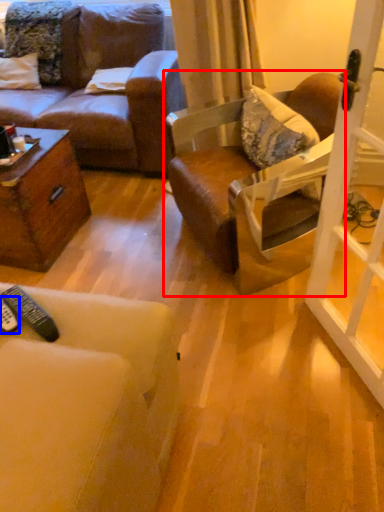
Question: Which object is closer to the camera taking this photo, chair (highlighted by a red box) or remote control (highlighted by a blue box)?

Choices:
 (A) chair
 (B) remote control

Answer: (B)